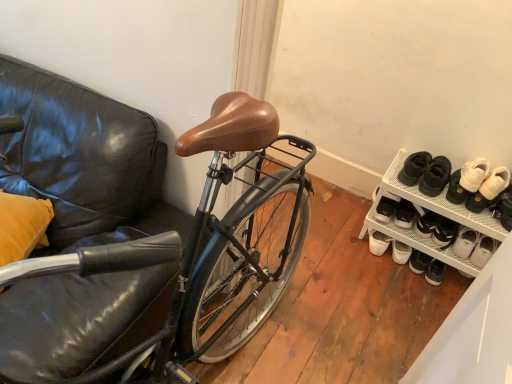
Question: Does point (423, 246) appear closer or farther from the camera than point (479, 208)?

Choices:
 (A) closer
 (B) farther

Answer: (B)

Question: Considering the positions of white mesh shoe rack at lower right and white suede sneakers at right, marked as the 2th footwear in a left-to-right arrangement, in the image, is white mesh shoe rack at lower right taller or shorter than white suede sneakers at right, marked as the 2th footwear in a left-to-right arrangement,?

Choices:
 (A) short
 (B) tall

Answer: (B)

Question: Estimate the real-world distances between objects in this image. Which object is farther from the white suede sneakers at upper right, which is the second footwear in right-to-left order?

Choices:
 (A) white leather shoe at lower right
 (B) white suede sneakers at right, marked as the 2th footwear in a left-to-right arrangement
 (C) white mesh shoe rack at lower right

Answer: (C)

Question: Which object is the farthest from the white leather shoe at lower right?

Choices:
 (A) white suede sneakers at right, marked as the 2th footwear in a left-to-right arrangement
 (B) white mesh shoe rack at lower right
 (C) white suede sneakers at upper right, which is the second footwear in right-to-left order

Answer: (B)